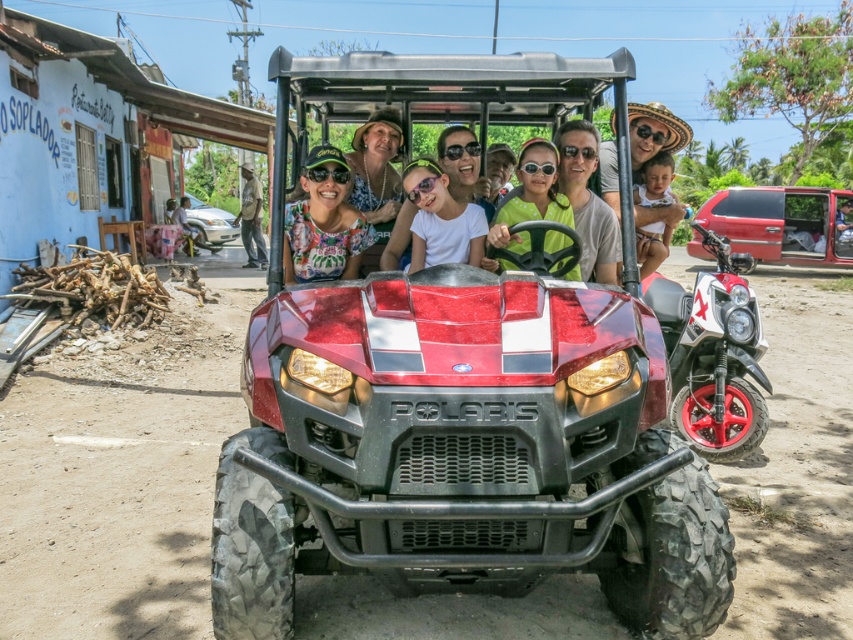
You are a photographer trying to capture the metallic red utility vehicle at center in a photo. Based on its position coordinates, where should you aim your camera?

The metallic red utility vehicle at center is located at coordinates point [462,451], so aim your camera there to capture it.

You are a photographer standing in front of the red Polaris ATV. You want to take a photo of the two points mentioned in the scene. Which point is closer to you, point (384,348) or point (643,196)?

Point (384,348) is closer to the viewer than point (643,196).

You are a photographer positioned at the origin point of the image coordinate system. You want to capture a closeup shot of the red matte dirt track at center. Which direction should you move your camera to focus on it?

The red matte dirt track at center is located at coordinates point (119, 477). Since the origin is at the bottom left corner, moving the camera to the upper right direction would align it with the track.